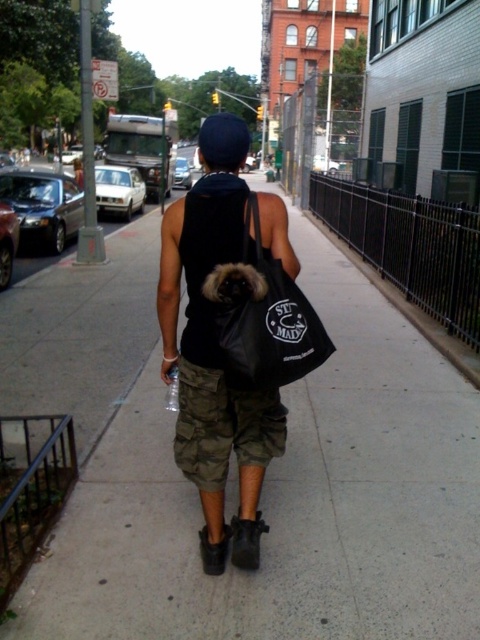
Which is more to the right, matte concrete sidewalk at center or black canvas tote at center?

black canvas tote at center is more to the right.

Is matte concrete sidewalk at center thinner than black canvas tote at center?

No.

Which is in front, point (433, 497) or point (213, 289)?

Point (213, 289) is more forward.

Locate an element on the screen. The image size is (480, 640). matte concrete sidewalk at center is located at coordinates (287, 500).

Is matte concrete sidewalk at center to the right of black matte bag at center from the viewer's perspective?

Indeed, matte concrete sidewalk at center is positioned on the right side of black matte bag at center.

Between matte concrete sidewalk at center and black matte bag at center, which one appears on the right side from the viewer's perspective?

Positioned to the right is matte concrete sidewalk at center.

This screenshot has height=640, width=480. I want to click on matte concrete sidewalk at center, so click(x=287, y=500).

Who is positioned more to the left, black matte bag at center or black canvas tote at center?

Positioned to the left is black matte bag at center.

Locate an element on the screen. black matte bag at center is located at coordinates (215, 352).